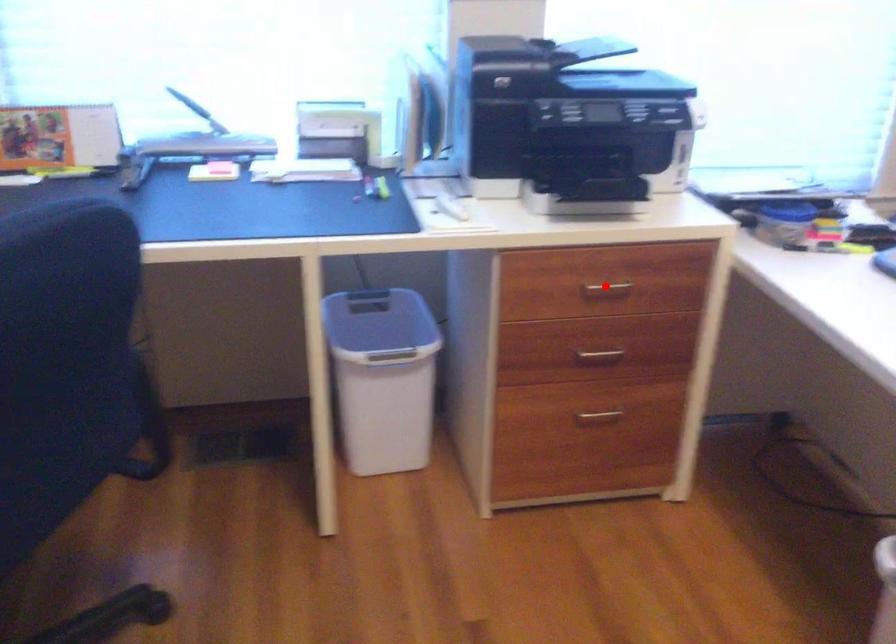
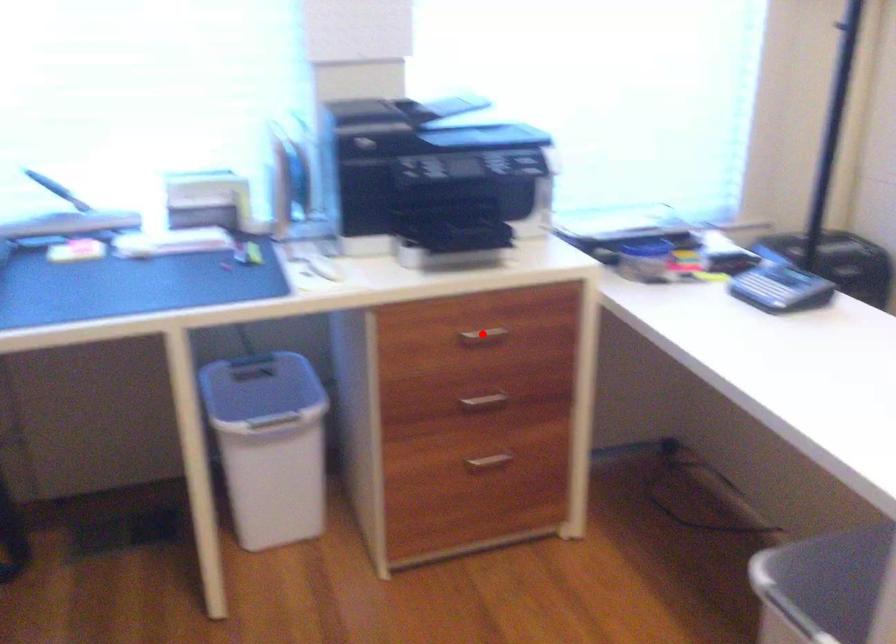
I am providing you with two images of the same scene from different viewpoints. A red point is marked on the first image and another point is marked on the second image. Are the points marked in image1 and image2 representing the same 3D position?

Yes